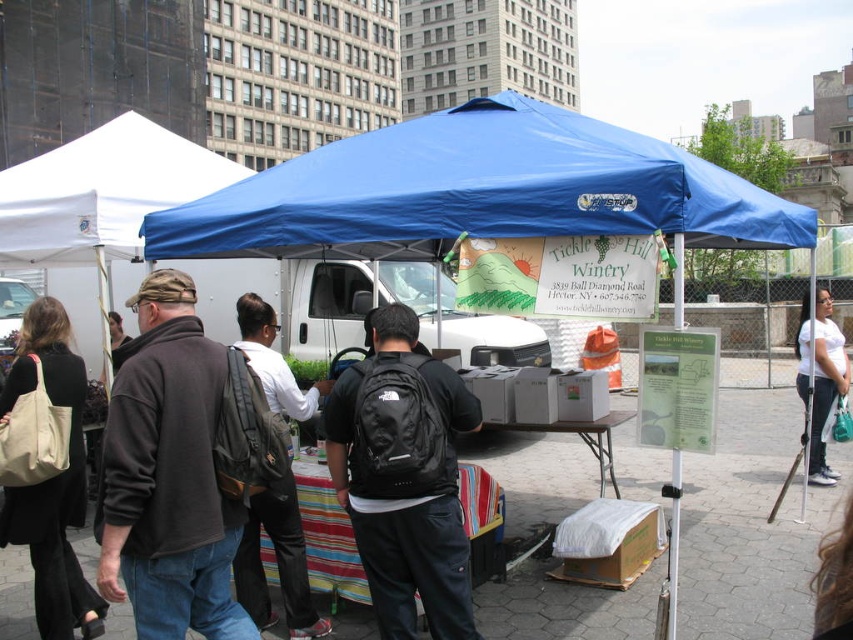
Between black fabric backpack at center and white fabric canopy at upper left, which one appears on the left side from the viewer's perspective?

From the viewer's perspective, white fabric canopy at upper left appears more on the left side.

Does black fabric backpack at center have a greater height compared to white fabric canopy at upper left?

Incorrect, black fabric backpack at center's height is not larger of white fabric canopy at upper left's.

Which is in front, point (404, 522) or point (138, 198)?

Positioned in front is point (404, 522).

Locate an element on the screen. black fabric backpack at center is located at coordinates 404,480.

Is black fabric backpack at center positioned in front of matte beige tote bag at left?

Yes, black fabric backpack at center is closer to the viewer.

Is black fabric backpack at center thinner than matte beige tote bag at left?

No.

Does point (408, 324) lie in front of point (54, 316)?

Yes, it is.

At what (x,y) coordinates should I click in order to perform the action: click on black fabric backpack at center. Please return your answer as a coordinate pair (x, y). This screenshot has width=853, height=640. Looking at the image, I should click on (404, 480).

Which is more to the left, black fabric backpack at center or dark gray backpack at center?

From the viewer's perspective, dark gray backpack at center appears more on the left side.

Is black fabric backpack at center to the left of dark gray backpack at center from the viewer's perspective?

Incorrect, black fabric backpack at center is not on the left side of dark gray backpack at center.

Which is in front, point (369, 365) or point (288, 486)?

Positioned in front is point (369, 365).

Locate an element on the screen. The image size is (853, 640). black fabric backpack at center is located at coordinates (404, 480).